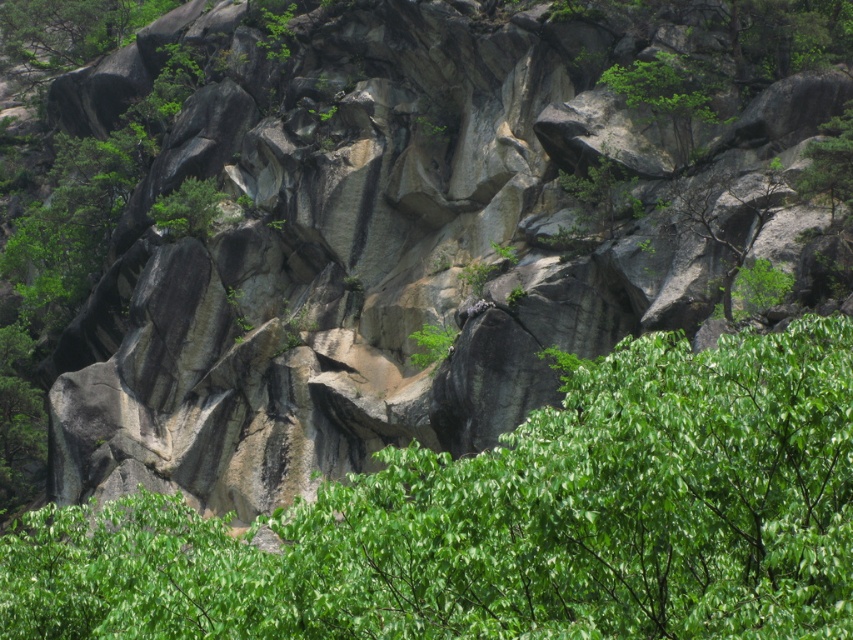
Can you confirm if green leafy tree at center is positioned to the left of green leafy tree at upper right?

Correct, you'll find green leafy tree at center to the left of green leafy tree at upper right.

Who is higher up, green leafy tree at center or green leafy tree at upper right?

green leafy tree at upper right is above.

Does point (712, 573) come farther from viewer compared to point (843, 144)?

No, it is in front of (843, 144).

Find the location of `green leafy tree at center`. green leafy tree at center is located at coordinates (514, 522).

Does green leafy tree at upper center appear on the right side of green leafy tree at upper right?

No, green leafy tree at upper center is not to the right of green leafy tree at upper right.

Which is in front, point (637, 65) or point (822, 148)?

Positioned in front is point (822, 148).

This screenshot has width=853, height=640. I want to click on green leafy tree at upper center, so click(x=663, y=96).

Who is higher up, green leafy tree at center or green leafy tree at upper center?

green leafy tree at upper center is above.

Which is more to the left, green leafy tree at center or green leafy tree at upper center?

From the viewer's perspective, green leafy tree at center appears more on the left side.

Which is in front, point (670, 483) or point (608, 84)?

Point (670, 483) is more forward.

I want to click on green leafy tree at center, so click(x=514, y=522).